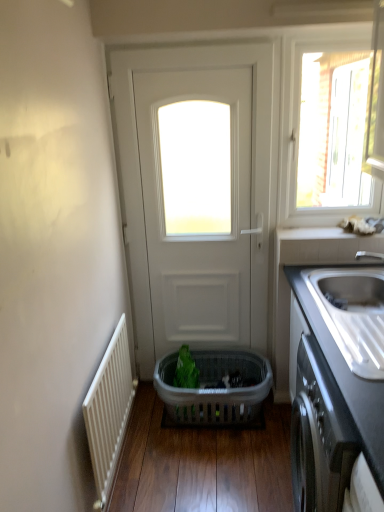
Question: Considering the positions of satin steel sink at right and white ceramic window sill at upper right in the image, is satin steel sink at right taller or shorter than white ceramic window sill at upper right?

Choices:
 (A) short
 (B) tall

Answer: (B)

Question: Considering the positions of satin steel sink at right and white ceramic window sill at upper right in the image, is satin steel sink at right wider or thinner than white ceramic window sill at upper right?

Choices:
 (A) wide
 (B) thin

Answer: (A)

Question: Considering the real-world distances, which object is closest to the white ceramic window sill at upper right?

Choices:
 (A) black matte cabinet at lower right
 (B) white ribbed radiator at left
 (C) satin steel sink at right
 (D) green plastic basket at center
 (E) transparent glass window at upper right

Answer: (C)

Question: Which object is the closest to the satin steel sink at right?

Choices:
 (A) white ceramic window sill at upper right
 (B) green plastic basket at center
 (C) white matte door at center
 (D) transparent glass window at upper right
 (E) translucent plastic basket at center

Answer: (A)